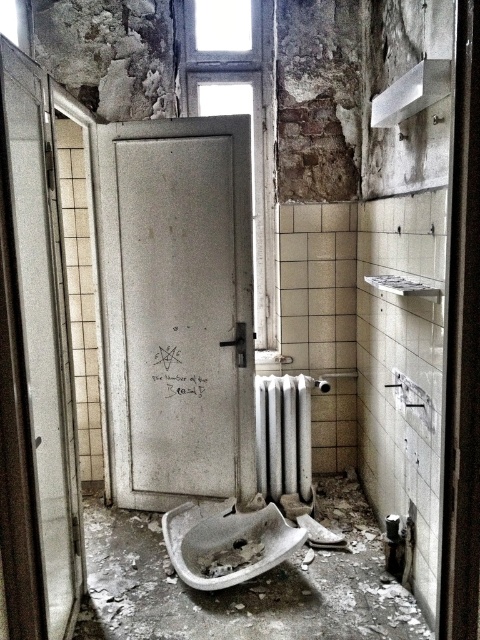
Can you confirm if white textured radiator at center is positioned to the right of cracked porcelain sink at center?

Correct, you'll find white textured radiator at center to the right of cracked porcelain sink at center.

Does point (302, 380) come closer to viewer compared to point (256, 545)?

No, (302, 380) is behind (256, 545).

Is point (287, 392) positioned after point (254, 550)?

Yes, it is behind point (254, 550).

Where is `white textured radiator at center`? The image size is (480, 640). white textured radiator at center is located at coordinates (284, 435).

Is cracked porcelain sink at center smaller than white plastic towel bar at upper center?

Incorrect, cracked porcelain sink at center is not smaller in size than white plastic towel bar at upper center.

Between cracked porcelain sink at center and white plastic towel bar at upper center, which one has more height?

With more height is cracked porcelain sink at center.

Describe the element at coordinates (230, 557) in the screenshot. This screenshot has width=480, height=640. I see `cracked porcelain sink at center` at that location.

Find the location of a particular element. cracked porcelain sink at center is located at coordinates (230, 557).

Who is positioned more to the right, cracked porcelain sink at lower center or white textured radiator at center?

white textured radiator at center is more to the right.

Is cracked porcelain sink at lower center above white textured radiator at center?

Incorrect, cracked porcelain sink at lower center is not positioned above white textured radiator at center.

I want to click on cracked porcelain sink at lower center, so click(226, 540).

This screenshot has width=480, height=640. Find the location of `cracked porcelain sink at lower center`. cracked porcelain sink at lower center is located at coordinates (226, 540).